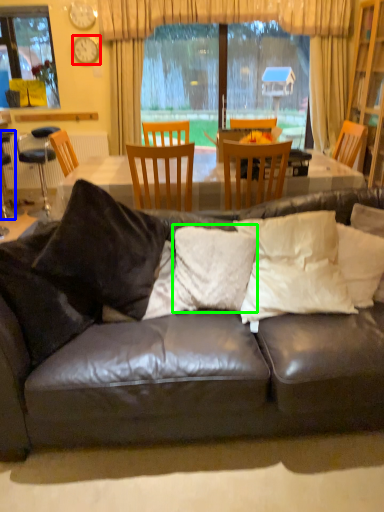
Question: Which object is the closest to the clock (highlighted by a red box)? Choose among these: bar stool (highlighted by a blue box) or pillow (highlighted by a green box).

Choices:
 (A) bar stool
 (B) pillow

Answer: (A)